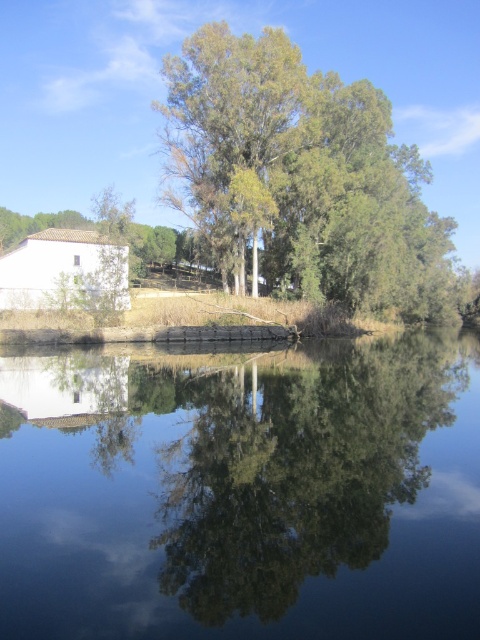
Is transparent glass lake at center below green leafy tree at upper center?

Yes.

Who is more distant from viewer, (286, 532) or (396, 180)?

Point (396, 180)

Image resolution: width=480 pixels, height=640 pixels. I want to click on transparent glass lake at center, so click(x=242, y=492).